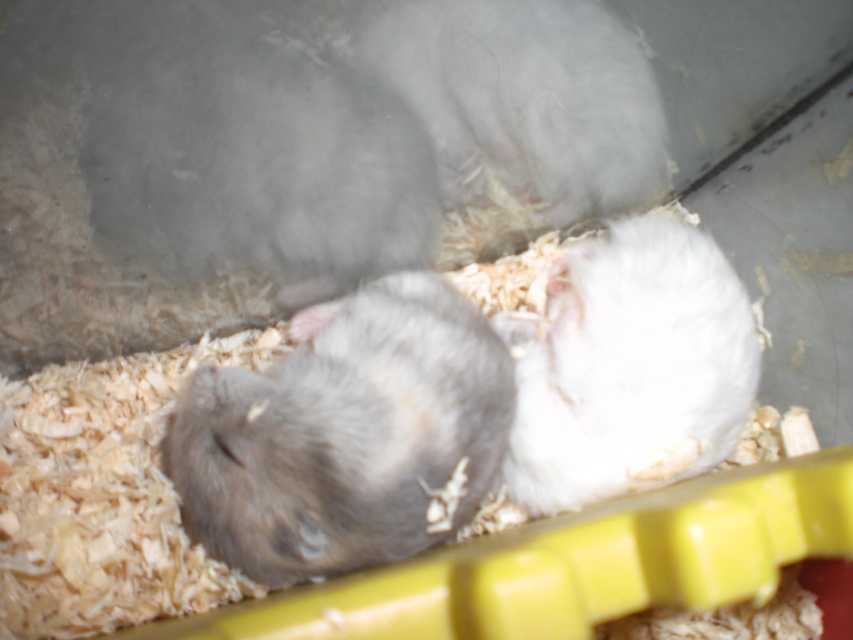
You are observing two points inside a hamster enclosure. The first point is at coordinates point (376, 442) and the second is at point (634, 476). Which of these points is nearer to you?

Point (376, 442) is closer to the viewer than point (634, 476).

You are a veterinarian examining two hamsters in an enclosure. You need to determine which hamster is larger in width to provide appropriate care. The enclosure has the gray fur hamster at center and the white fluffy hamster at right. Which hamster has a greater width?

The gray fur hamster at center has a greater width than the white fluffy hamster at right.

Consider the image. You are a vet examining two hamsters in an enclosure. The enclosure has a small opening at the top. You need to determine which hamster, the gray fur hamster at center or the white fluffy hamster at right, might have difficulty exiting through the opening. Based on their sizes, which one is more likely to struggle?

The gray fur hamster at center is larger in size than the white fluffy hamster at right, so it might have more difficulty exiting through the opening.